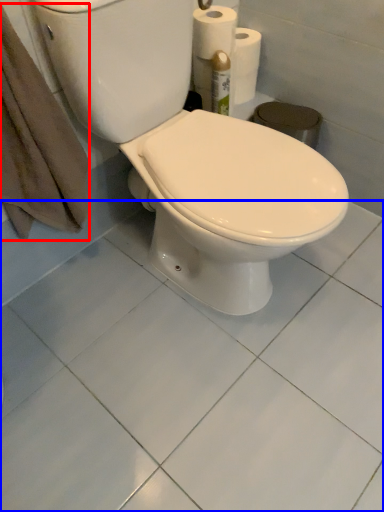
Question: Which object is closer to the camera taking this photo, bath towel (highlighted by a red box) or ceramic tile (highlighted by a blue box)?

Choices:
 (A) bath towel
 (B) ceramic tile

Answer: (A)